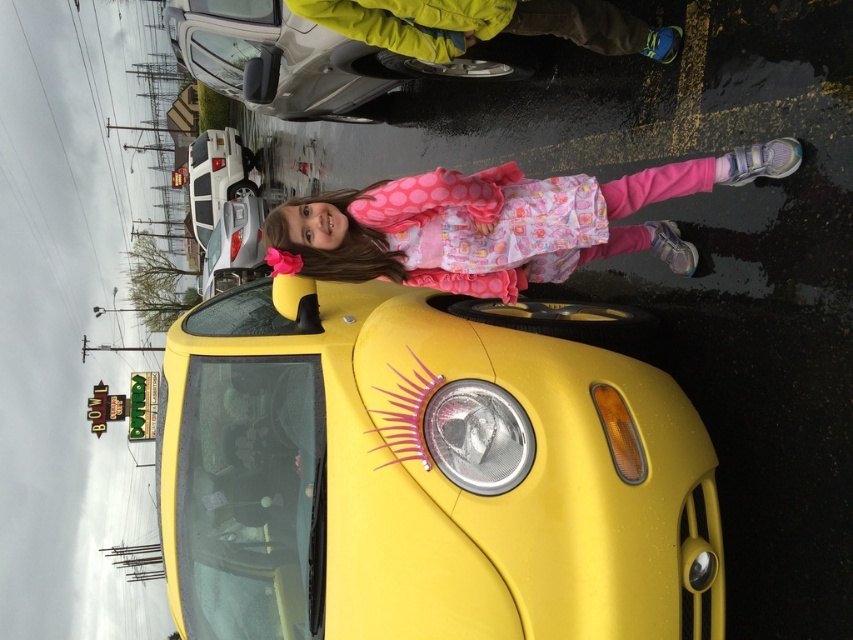
Based on the photo, you are a parking attendant and need to move the metallic silver car at upper left. Can you exit the parking space without moving the white glossy suv at upper left?

The metallic silver car at upper left is behind the white glossy suv at upper left, so it can exit its parking space without moving the white glossy suv at upper left because it can back out first.

You are a parking attendant and need to determine if the metallic silver car at upper center can fit into a parking spot that is the same width as the yellow fabric jacket at upper center. Can it fit?

The metallic silver car at upper center is narrower than the yellow fabric jacket at upper center, so it can fit into the parking spot.

You are a parking attendant who needs to guide a delivery truck that is 2 meters tall to a parking spot. Looking at the image, can the delivery truck fit between the white glossy suv at upper left and the metallic silver car at upper left?

The white glossy suv at upper left is much taller than the metallic silver car at upper left. Since the delivery truck is 2 meters tall, it can only fit if there is enough vertical clearance. However, the height of the white glossy suv at upper left is not provided, so it is uncertain if the truck can pass between them.